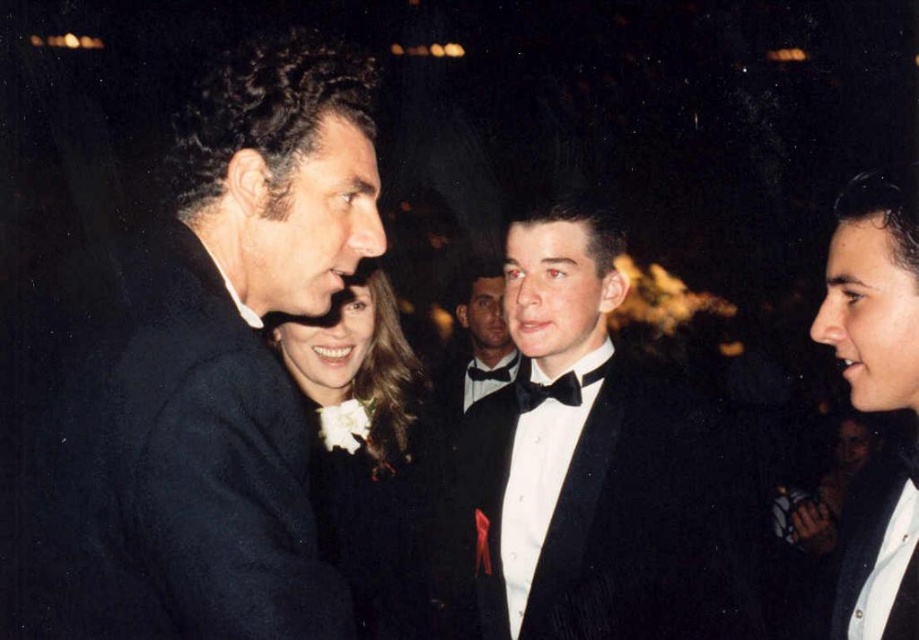
You are a photographer at the event and want to capture a photo that includes both the black velvet tuxedo at center and the white satin flower at center. Based on their positions, which object should you focus on first to ensure both are in frame?

The black velvet tuxedo at center is to the right of the white satin flower at center, so you should focus on the white satin flower at center first to ensure both are in frame.

You are a photographer at the event and want to capture a group photo of the velvet black suit at left and the black velvet tuxedo at center. The camera you are using has a maximum focus range of 35 inches. Will you need to adjust your position to ensure both are in focus?

The distance between the velvet black suit at left and the black velvet tuxedo at center is 37.01 inches, which exceeds the camera maximum focus range of 35 inches. Therefore, you will need to move closer to ensure both are within the focus range.